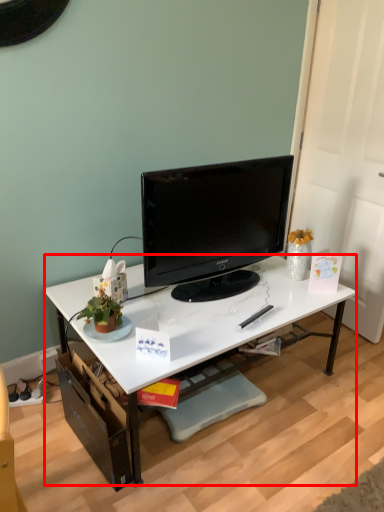
Question: From the image's perspective, what is the correct spatial relationship of desk (annotated by the red box) in relation to television?

Choices:
 (A) below
 (B) above

Answer: (A)